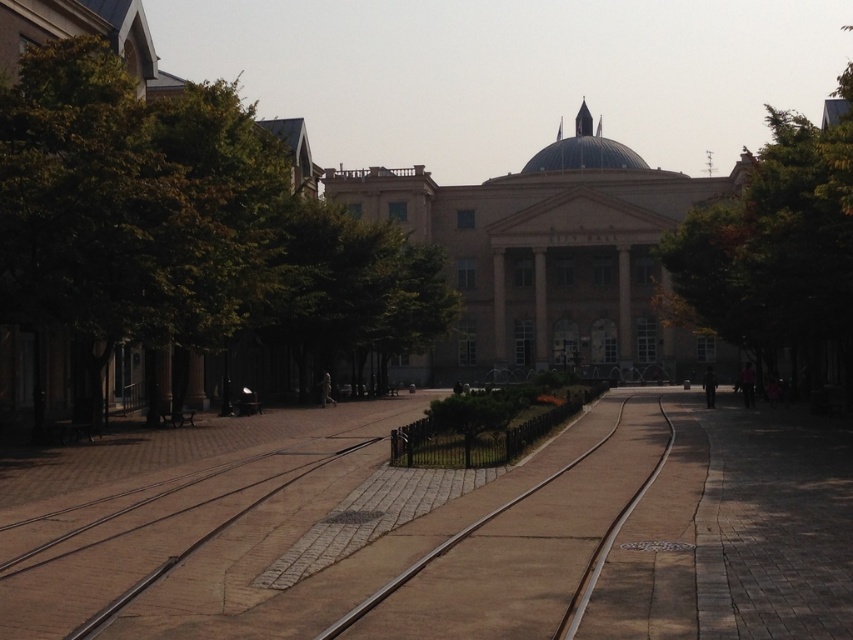
You are standing at the entrance of the building and want to walk to the brown concrete train track at center. Which direction should you turn to avoid the green leafy tree at left?

You should turn to the right to avoid the green leafy tree at left, as it is located to the left of the brown concrete train track at center.

You are a tourist standing on the paved pathway leading to the classical building. You see the green leafy tree at left and the brown concrete train track at center. Which object is closer to you?

The green leafy tree at left is closer to you because the brown concrete train track at center is behind it.